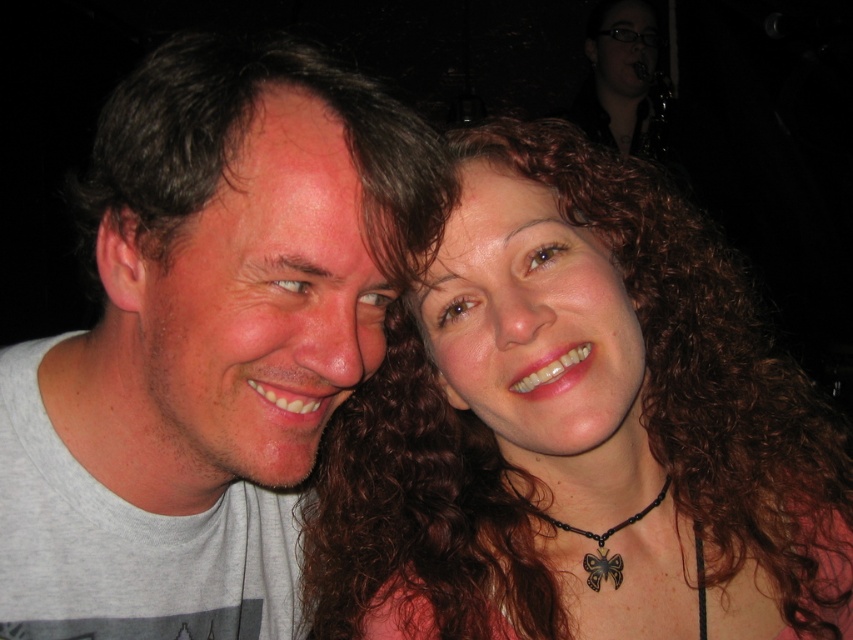
You are standing in front of the scene and want to touch both the point at coordinates (223,58) and the point at coordinates (621,522). Which point will require you to reach further out to touch?

The point at coordinates (621,522) will require you to reach further out because it is farther from the viewer compared to the point at (223,58).